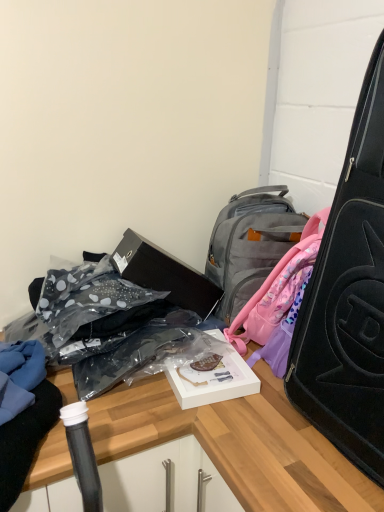
Question: Is black matte box at center closer to camera compared to clear plastic bag at lower left?

Choices:
 (A) no
 (B) yes

Answer: (A)

Question: Is black matte box at center at the right side of clear plastic bag at lower left?

Choices:
 (A) yes
 (B) no

Answer: (A)

Question: Considering the relative sizes of black matte box at center and clear plastic bag at lower left in the image provided, is black matte box at center smaller than clear plastic bag at lower left?

Choices:
 (A) no
 (B) yes

Answer: (B)

Question: Is black matte box at center not within clear plastic bag at lower left?

Choices:
 (A) no
 (B) yes

Answer: (A)

Question: Does black matte box at center have a greater width compared to clear plastic bag at lower left?

Choices:
 (A) yes
 (B) no

Answer: (B)

Question: Does black matte box at center appear on the left side of clear plastic bag at lower left?

Choices:
 (A) no
 (B) yes

Answer: (A)

Question: From a real-world perspective, is white matte box at center positioned over gray fabric backpack at upper center based on gravity?

Choices:
 (A) yes
 (B) no

Answer: (B)

Question: From a real-world perspective, is white matte box at center physically below gray fabric backpack at upper center?

Choices:
 (A) no
 (B) yes

Answer: (B)

Question: Is white matte box at center looking in the opposite direction of gray fabric backpack at upper center?

Choices:
 (A) yes
 (B) no

Answer: (B)

Question: From the image's perspective, is white matte box at center located above gray fabric backpack at upper center?

Choices:
 (A) yes
 (B) no

Answer: (B)

Question: Considering the relative positions of white matte box at center and gray fabric backpack at upper center in the image provided, is white matte box at center to the right of gray fabric backpack at upper center from the viewer's perspective?

Choices:
 (A) yes
 (B) no

Answer: (B)

Question: Considering the relative sizes of white matte box at center and gray fabric backpack at upper center in the image provided, is white matte box at center thinner than gray fabric backpack at upper center?

Choices:
 (A) no
 (B) yes

Answer: (B)

Question: Is clear plastic bag at lower left facing towards black matte suitcase at right?

Choices:
 (A) yes
 (B) no

Answer: (B)